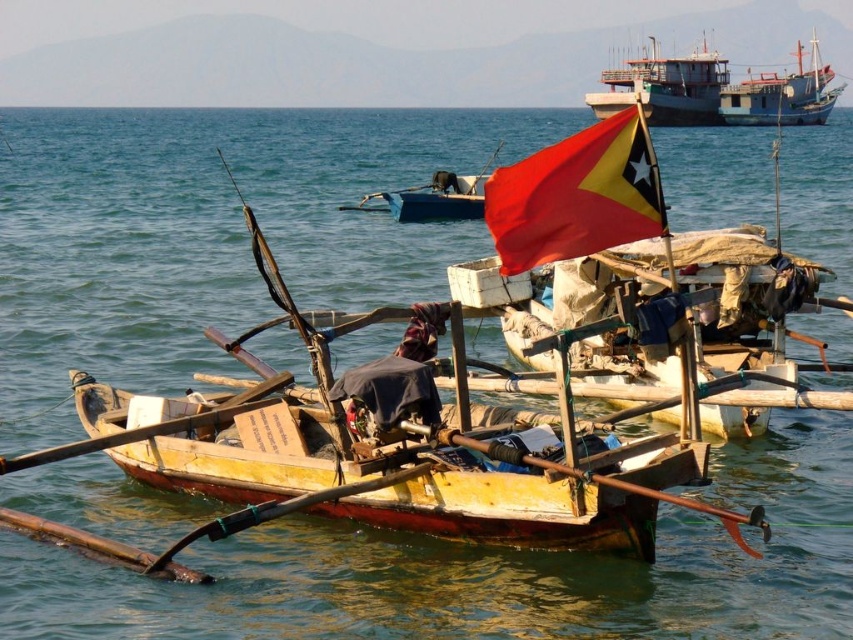
Question: Estimate the real-world distances between objects in this image. Which object is farther from the wooden boat at center?

Choices:
 (A) wooden fishing boat at upper right
 (B) metallic gray ship at upper center

Answer: (A)

Question: Which object is closer to the camera taking this photo?

Choices:
 (A) red matte flag at upper center
 (B) metallic gray ship at upper center
 (C) wooden boat at center
 (D) wooden paddle at lower left

Answer: (A)

Question: Does wooden boat at center appear under wooden fishing boat at upper right?

Choices:
 (A) yes
 (B) no

Answer: (A)

Question: Which object is closer to the camera taking this photo?

Choices:
 (A) wooden boat at center
 (B) wooden paddle at lower left
 (C) red matte flag at upper center
 (D) wooden fishing boat at upper right

Answer: (C)

Question: In this image, where is red matte flag at upper center located relative to wooden paddle at lower left?

Choices:
 (A) below
 (B) above

Answer: (B)

Question: Does metallic gray ship at upper center have a greater width compared to wooden fishing boat at upper right?

Choices:
 (A) yes
 (B) no

Answer: (A)